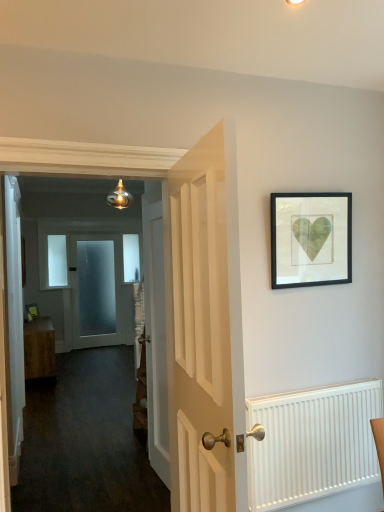
Locate an element on the screen. The image size is (384, 512). clear glass window at upper left, acting as the first window starting from the left is located at coordinates (57, 261).

Identify the location of white ribbed radiator at lower right. (312, 443).

The width and height of the screenshot is (384, 512). What do you see at coordinates (96, 290) in the screenshot?
I see `frosted glass door at center, placed as the 3th door when sorted from right to left` at bounding box center [96, 290].

Measure the distance between point (47, 325) and camera.

The distance of point (47, 325) from camera is 22.03 feet.

Identify the location of clear glass window at center, which is counted as the 1th window, starting from the right. tap(131, 258).

Find the location of a particular element. The height and width of the screenshot is (512, 384). white wooden door at center, positioned as the 2th door in left-to-right order is located at coordinates (155, 331).

From the image's perspective, does black matte picture frame at upper right appear higher than white wooden door at center, marked as the 2th door in a right-to-left arrangement?

Indeed, from the image's perspective, black matte picture frame at upper right is shown above white wooden door at center, marked as the 2th door in a right-to-left arrangement.

Can you confirm if black matte picture frame at upper right is shorter than white wooden door at center, marked as the 2th door in a right-to-left arrangement?

Correct, black matte picture frame at upper right is not as tall as white wooden door at center, marked as the 2th door in a right-to-left arrangement.

Is black matte picture frame at upper right in front of white wooden door at center, which is the second door from front to back?

Yes.

In terms of size, does black matte picture frame at upper right appear bigger or smaller than white wooden door at center, positioned as the 2th door in left-to-right order?

Clearly, black matte picture frame at upper right is smaller in size than white wooden door at center, positioned as the 2th door in left-to-right order.

Which object is closer to the camera taking this photo, black matte picture frame at upper right or white ribbed radiator at lower right?

white ribbed radiator at lower right is more forward.

In terms of height, does black matte picture frame at upper right look taller or shorter compared to white ribbed radiator at lower right?

black matte picture frame at upper right is shorter than white ribbed radiator at lower right.

From the picture: From the image's perspective, does black matte picture frame at upper right appear lower than white ribbed radiator at lower right?

No, from the image's perspective, black matte picture frame at upper right is not below white ribbed radiator at lower right.

Identify the location of picture frame above the white ribbed radiator at lower right (from the image's perspective). The width and height of the screenshot is (384, 512). (311, 239).

Looking at their sizes, would you say white ribbed radiator at lower right is wider or thinner than black matte picture frame at upper right?

In the image, white ribbed radiator at lower right appears to be wider than black matte picture frame at upper right.

Is white ribbed radiator at lower right in front of or behind black matte picture frame at upper right in the image?

white ribbed radiator at lower right is in front of black matte picture frame at upper right.

The image size is (384, 512). Find the location of `corridor positioned vertically above the white wooden door at center, which is the second door from front to back (from a real-world perspective)`. corridor positioned vertically above the white wooden door at center, which is the second door from front to back (from a real-world perspective) is located at coordinates click(x=83, y=373).

Considering the sizes of objects white wooden door at center, positioned as the 2th door in left-to-right order, and smooth white door at center in the image provided, who is wider, white wooden door at center, positioned as the 2th door in left-to-right order, or smooth white door at center?

smooth white door at center.

Is white wooden door at center, which is the second door from front to back, not near smooth white door at center?

Yes.

Is white wooden door at center, marked as the 2th door in a right-to-left arrangement, looking in the opposite direction of smooth white door at center?

white wooden door at center, marked as the 2th door in a right-to-left arrangement, is not turned away from smooth white door at center.

Can you tell me how much wooden cabinet at left and white wooden door at center, arranged as the 1th door when viewed from the right, differ in facing direction?

They differ by 177 degrees in their facing directions.

Which of these two, wooden cabinet at left or white wooden door at center, the first door positioned from the front, is smaller?

Smaller between the two is white wooden door at center, the first door positioned from the front.

Is wooden cabinet at left placed right next to white wooden door at center, the first door positioned from the front?

There is a gap between wooden cabinet at left and white wooden door at center, the first door positioned from the front.

Could frosted glass door at center, acting as the third door starting from the front, be considered to be inside white wooden door at center, marked as the 3th door in a left-to-right arrangement?

Definitely not — frosted glass door at center, acting as the third door starting from the front, is not inside white wooden door at center, marked as the 3th door in a left-to-right arrangement.

Is white wooden door at center, marked as the 3th door in a left-to-right arrangement, placed right next to frosted glass door at center, the 1th door in the back-to-front sequence?

No, white wooden door at center, marked as the 3th door in a left-to-right arrangement, is not with frosted glass door at center, the 1th door in the back-to-front sequence.

Measure the distance between white wooden door at center, arranged as the third door when viewed from the back, and frosted glass door at center, acting as the third door starting from the front.

white wooden door at center, arranged as the third door when viewed from the back, is 5.49 meters away from frosted glass door at center, acting as the third door starting from the front.

Looking at this image, who is more distant, white wooden door at center, arranged as the 1th door when viewed from the right, or frosted glass door at center, acting as the third door starting from the front?

Positioned behind is frosted glass door at center, acting as the third door starting from the front.

There is a smooth white door at center. What are the coordinates of `the 2nd door below it (from a real-world perspective)` in the screenshot? It's located at (96, 290).

Which object is wider, smooth white door at center or frosted glass door at center, acting as the third door starting from the front?

smooth white door at center.

Which is more to the right, smooth white door at center or frosted glass door at center, placed as the 3th door when sorted from right to left?

From the viewer's perspective, smooth white door at center appears more on the right side.

Is smooth white door at center in contact with frosted glass door at center, placed as the 3th door when sorted from right to left?

They are not placed beside each other.

The width and height of the screenshot is (384, 512). I want to click on door that is the 2nd object to the left of the black matte picture frame at upper right, starting at the anchor, so click(x=155, y=331).

Identify the location of radiator below the black matte picture frame at upper right (from a real-world perspective). The height and width of the screenshot is (512, 384). (312, 443).

From the image, which object appears to be farther from wooden cabinet at left, white wooden door at center, marked as the 2th door in a right-to-left arrangement, or clear glass window at center, the 2th window from the front?

white wooden door at center, marked as the 2th door in a right-to-left arrangement, lies further to wooden cabinet at left than the other object.

Looking at the image, which one is located closer to wooden cabinet at left, smooth white door at center or white wooden door at center, marked as the 3th door in a left-to-right arrangement?

Based on the image, smooth white door at center appears to be nearer to wooden cabinet at left.

Based on their spatial positions, is frosted glass door at center, the 1th door in the back-to-front sequence, or white wooden door at center, marked as the 2th door in a right-to-left arrangement, further from black matte picture frame at upper right?

frosted glass door at center, the 1th door in the back-to-front sequence, is positioned further to the anchor black matte picture frame at upper right.

Considering their positions, is white wooden door at center, the 2th door from the back, positioned further to smooth white door at center than white wooden door at center, arranged as the 1th door when viewed from the right?

Among the two, white wooden door at center, arranged as the 1th door when viewed from the right, is located further to smooth white door at center.

Which object lies nearer to the anchor point black matte picture frame at upper right, clear glass window at center, the 2th window from the front, or white wooden door at center, marked as the 3th door in a left-to-right arrangement?

white wooden door at center, marked as the 3th door in a left-to-right arrangement.

Which object lies further to the anchor point white wooden door at center, which is the second door from front to back, smooth white door at center or white ribbed radiator at lower right?

Based on the image, smooth white door at center appears to be further to white wooden door at center, which is the second door from front to back.

Which object lies further to the anchor point black matte picture frame at upper right, smooth white door at center or clear glass window at center, which appears as the 1th window when viewed from the back?

smooth white door at center.

Considering their positions, is frosted glass door at center, acting as the third door starting from the front, positioned further to black matte picture frame at upper right than smooth white door at center?

frosted glass door at center, acting as the third door starting from the front.

You are a GUI agent. You are given a task and a screenshot of the screen. Output one action in this format:
    pyautogui.click(x=<x>, y=<y>)
    Task: Click on the door between white wooden door at center, arranged as the 1th door when viewed from the right, and frosted glass door at center, placed as the 1th door when sorted from left to right, from front to back
    This screenshot has height=512, width=384.
    Given the screenshot: What is the action you would take?
    pyautogui.click(x=155, y=331)

At what (x,y) coordinates should I click in order to perform the action: click on door located between wooden cabinet at left and clear glass window at center, which appears as the 1th window when viewed from the back, in the depth direction. Please return your answer as a coordinate pair (x, y). This screenshot has width=384, height=512. Looking at the image, I should click on (96, 290).

You are a GUI agent. You are given a task and a screenshot of the screen. Output one action in this format:
    pyautogui.click(x=<x>, y=<y>)
    Task: Click on the furniture positioned between black matte picture frame at upper right and frosted glass door at center, acting as the third door starting from the front, from near to far
    Image resolution: width=384 pixels, height=512 pixels.
    Given the screenshot: What is the action you would take?
    pyautogui.click(x=39, y=348)

Where is `furniture between smooth white door at center and clear glass window at upper left, acting as the 2th window starting from the back, in the front-back direction`? The height and width of the screenshot is (512, 384). furniture between smooth white door at center and clear glass window at upper left, acting as the 2th window starting from the back, in the front-back direction is located at coordinates (39, 348).